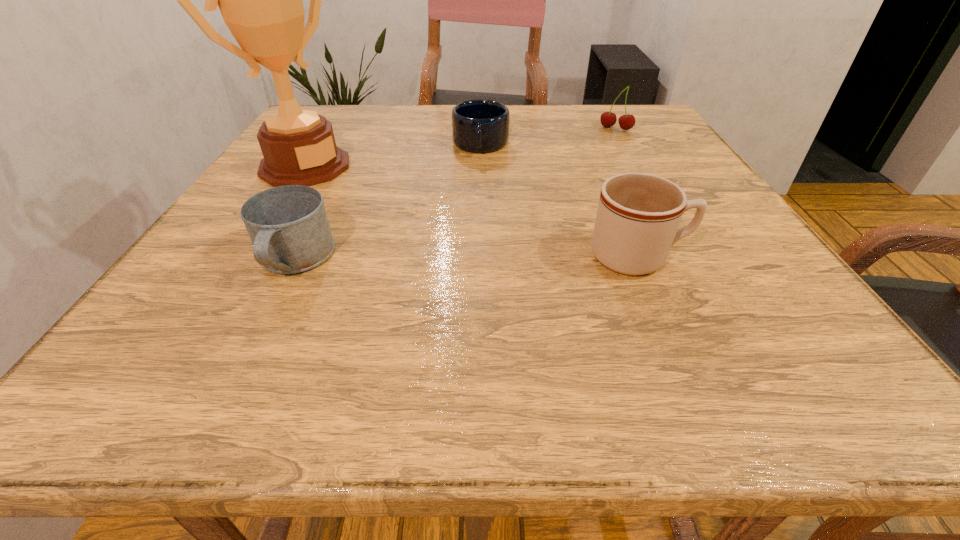
At what (x,y) coordinates should I click in order to perform the action: click on the leftmost mug. Please return your answer as a coordinate pair (x, y). Looking at the image, I should click on (288, 226).

Where is `the rightmost mug`? The height and width of the screenshot is (540, 960). the rightmost mug is located at coordinates (638, 216).

Find the location of a particular element. The width and height of the screenshot is (960, 540). the farthest mug is located at coordinates (480, 126).

Identify the location of the third object from right to left. (x=480, y=126).

Identify the location of cherry. (608, 119).

Where is `the tallest object`? This screenshot has height=540, width=960. the tallest object is located at coordinates (260, 0).

Where is `vacant space positioned with the handle on the side of the third object from left to right`? This screenshot has width=960, height=540. vacant space positioned with the handle on the side of the third object from left to right is located at coordinates (469, 260).

At what (x,y) coordinates should I click in order to perform the action: click on vacant space located 0.140m with the handle on the side of the third object from left to right. Please return your answer as a coordinate pair (x, y). Looking at the image, I should click on (476, 191).

Find the location of a particular element. The image size is (960, 540). vacant space located 0.230m with the handle on the side of the third object from left to right is located at coordinates (473, 215).

At what (x,y) coordinates should I click in order to perform the action: click on vacant region located 0.260m on the surface of the cherry. Please return your answer as a coordinate pair (x, y). Looking at the image, I should click on pos(574,175).